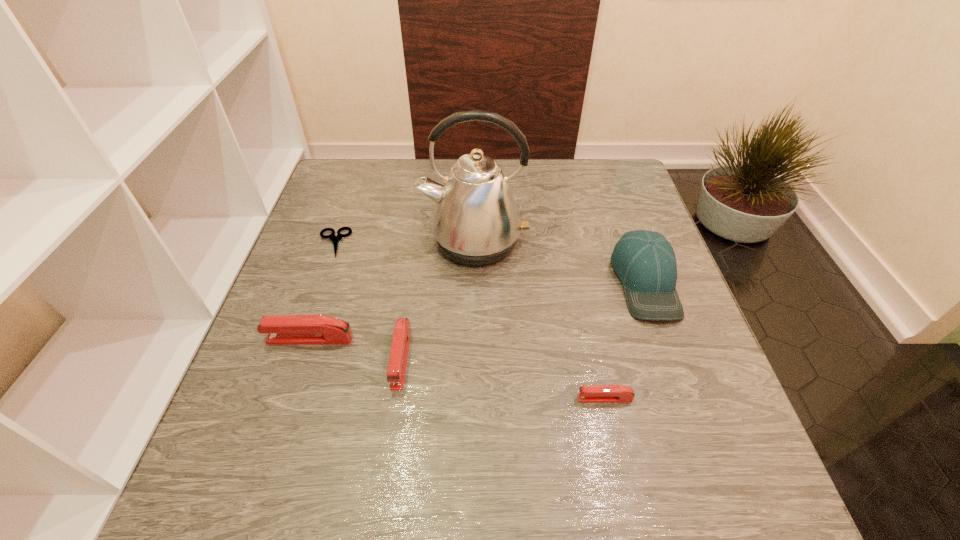
At what (x,y) coordinates should I click in order to perform the action: click on free space between the baseball cap and the leftmost stapler. Please return your answer as a coordinate pair (x, y). Looking at the image, I should click on (477, 310).

Where is `free space between the third shortest object and the shears`? free space between the third shortest object and the shears is located at coordinates (368, 300).

The width and height of the screenshot is (960, 540). Find the location of `empty space between the leftmost stapler and the kettle`. empty space between the leftmost stapler and the kettle is located at coordinates (392, 291).

I want to click on vacant space that is in between the second tallest stapler and the shortest stapler, so click(503, 378).

The width and height of the screenshot is (960, 540). I want to click on free space that is in between the baseball cap and the leftmost stapler, so click(x=477, y=310).

The height and width of the screenshot is (540, 960). I want to click on object that is the second closest to the nearest object, so click(x=476, y=222).

Identify the location of object identified as the fourth closest to the second tallest stapler. This screenshot has width=960, height=540. (587, 393).

Identify which stapler is the closest to the kettle. Please provide its 2D coordinates. Your answer should be formatted as a tuple, i.e. [(x, y)], where the tuple contains the x and y coordinates of a point satisfying the conditions above.

[(397, 364)]

The width and height of the screenshot is (960, 540). I want to click on stapler that is the closest to the kettle, so click(397, 364).

Where is `free space that satisfies the following two spatial constraints: 1. from the spout of the rightmost object; 2. on the left side of the tallest object`? The width and height of the screenshot is (960, 540). free space that satisfies the following two spatial constraints: 1. from the spout of the rightmost object; 2. on the left side of the tallest object is located at coordinates (473, 282).